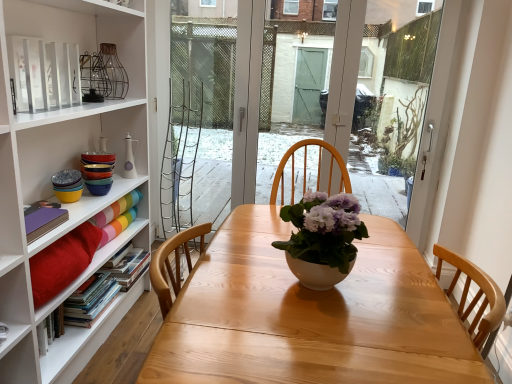
Question: Does matte rainbow paper at left, the first book from the top, have a lesser height compared to hardcover books at left, the 2th book ordered from the bottom?

Choices:
 (A) yes
 (B) no

Answer: (A)

Question: Can you confirm if matte rainbow paper at left, which ranks as the 4th book in bottom-to-top order, is taller than hardcover books at left, arranged as the 3th book when viewed from the top?

Choices:
 (A) no
 (B) yes

Answer: (A)

Question: From a real-world perspective, is matte rainbow paper at left, the first book from the top, positioned over hardcover books at left, arranged as the 3th book when viewed from the top, based on gravity?

Choices:
 (A) no
 (B) yes

Answer: (B)

Question: From the image's perspective, is matte rainbow paper at left, the first book from the top, under hardcover books at left, the 2th book ordered from the bottom?

Choices:
 (A) no
 (B) yes

Answer: (A)

Question: Could you tell me if matte rainbow paper at left, which ranks as the 4th book in bottom-to-top order, is turned towards hardcover books at left, arranged as the 3th book when viewed from the top?

Choices:
 (A) yes
 (B) no

Answer: (B)

Question: Is hardcover book at left, acting as the 1th book starting from the bottom, taller or shorter than matte rainbow paper at left, the first book from the top?

Choices:
 (A) tall
 (B) short

Answer: (A)

Question: In terms of width, does hardcover book at left, acting as the 1th book starting from the bottom, look wider or thinner when compared to matte rainbow paper at left, which ranks as the 4th book in bottom-to-top order?

Choices:
 (A) wide
 (B) thin

Answer: (A)

Question: Based on their sizes in the image, would you say hardcover book at left, acting as the fourth book starting from the top, is bigger or smaller than matte rainbow paper at left, which ranks as the 4th book in bottom-to-top order?

Choices:
 (A) small
 (B) big

Answer: (B)

Question: Is hardcover book at left, acting as the 1th book starting from the bottom, to the left or to the right of matte rainbow paper at left, the first book from the top, in the image?

Choices:
 (A) right
 (B) left

Answer: (B)

Question: From a real-world perspective, is hardcover book at left, acting as the fourth book starting from the top, physically located above or below white matte vase at center?

Choices:
 (A) above
 (B) below

Answer: (B)

Question: From the image's perspective, is hardcover book at left, acting as the 1th book starting from the bottom, positioned above or below white matte vase at center?

Choices:
 (A) below
 (B) above

Answer: (A)

Question: Considering the positions of hardcover book at left, acting as the fourth book starting from the top, and white matte vase at center in the image, is hardcover book at left, acting as the fourth book starting from the top, wider or thinner than white matte vase at center?

Choices:
 (A) thin
 (B) wide

Answer: (B)

Question: Is hardcover book at left, acting as the fourth book starting from the top, spatially inside white matte vase at center, or outside of it?

Choices:
 (A) inside
 (B) outside

Answer: (B)

Question: Is matte rainbow paper at left, the first book from the top, inside the boundaries of wooden table at center, or outside?

Choices:
 (A) inside
 (B) outside

Answer: (B)

Question: From the image's perspective, is matte rainbow paper at left, the first book from the top, located above or below wooden table at center?

Choices:
 (A) above
 (B) below

Answer: (A)